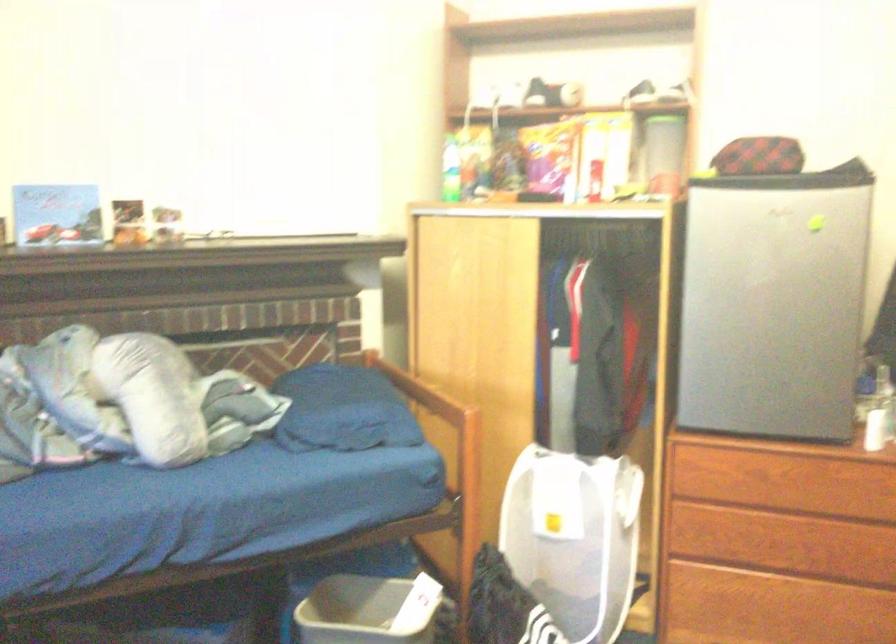
I want to click on fridge door, so click(x=771, y=303).